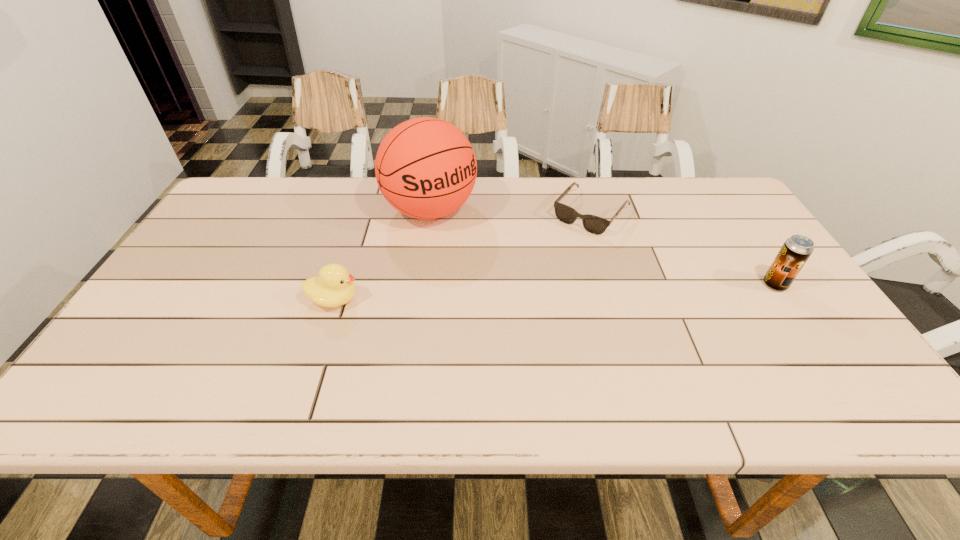
Find the location of a particular element. The image size is (960, 540). duckling is located at coordinates (334, 286).

I want to click on the second tallest object, so click(796, 250).

This screenshot has width=960, height=540. In order to click on the rightmost object in this screenshot , I will do `click(796, 250)`.

Locate an element on the screen. the tallest object is located at coordinates (426, 168).

Identify the location of the shortest object. This screenshot has width=960, height=540. (596, 225).

Locate an element on the screen. This screenshot has width=960, height=540. sunglasses is located at coordinates (596, 225).

I want to click on vacant area situated 0.250m on the beak of the second shortest object, so click(462, 300).

At what (x,y) coordinates should I click in order to perform the action: click on vacant space located on the back of the second tallest object. Please return your answer as a coordinate pair (x, y). This screenshot has height=540, width=960. Looking at the image, I should click on (745, 240).

Image resolution: width=960 pixels, height=540 pixels. I want to click on vacant space located 0.120m on the side with logo of the basketball, so click(476, 259).

In order to click on free location located 0.260m on the side with logo of the basketball in this screenshot , I will do `click(506, 289)`.